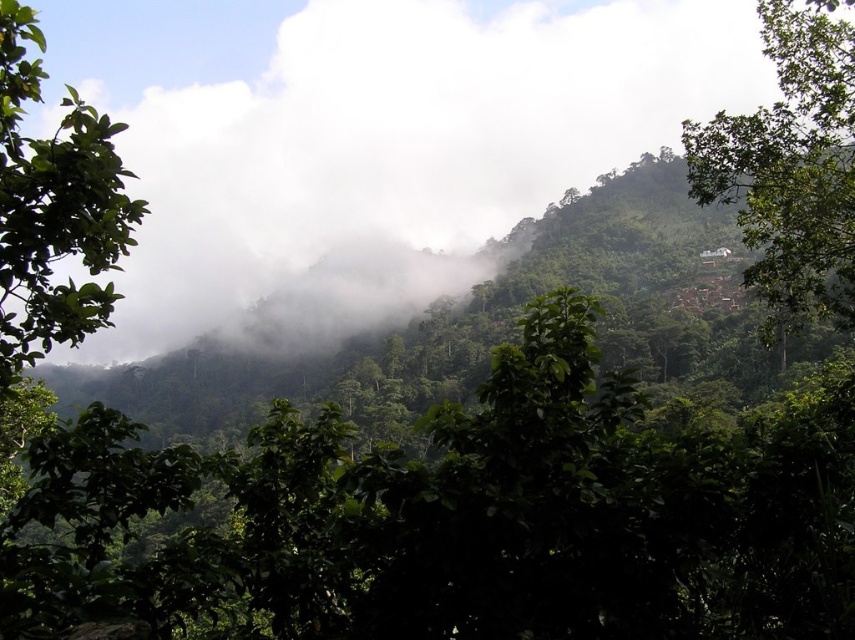
Question: Which point is closer to the camera?

Choices:
 (A) white fluffy cloud at upper center
 (B) green leafy tree at upper right

Answer: (B)

Question: Which point is farther from the camera taking this photo?

Choices:
 (A) (668, 0)
 (B) (768, 172)

Answer: (A)

Question: Among these points, which one is nearest to the camera?

Choices:
 (A) (7, 304)
 (B) (730, 124)
 (C) (201, 209)

Answer: (A)

Question: Can you confirm if white fluffy cloud at upper center is positioned above green leafy tree at upper right?

Choices:
 (A) no
 (B) yes

Answer: (B)

Question: Is white fluffy cloud at upper center positioned before green leafy tree at upper right?

Choices:
 (A) yes
 (B) no

Answer: (B)

Question: Is white fluffy cloud at upper center positioned at the back of green leafy tree at left?

Choices:
 (A) yes
 (B) no

Answer: (A)